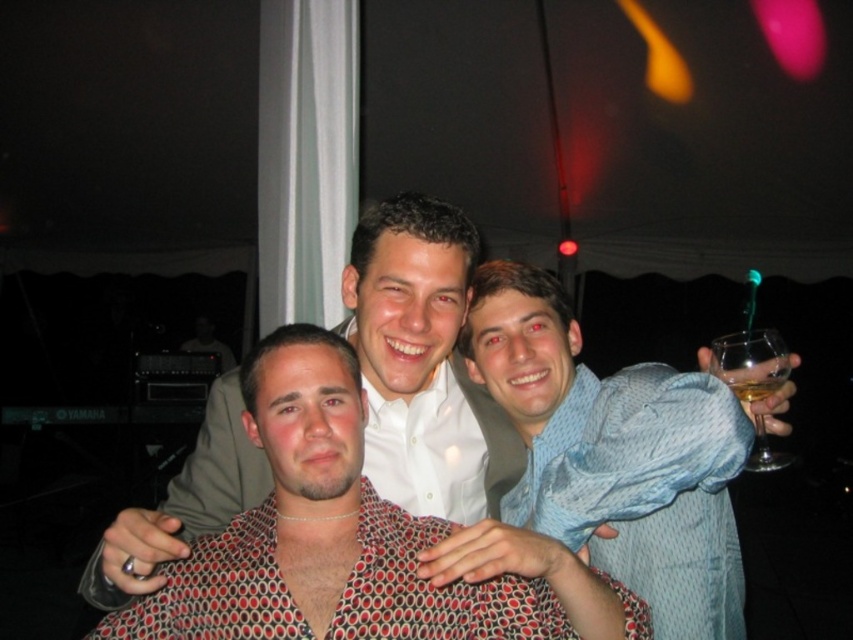
Question: Can you confirm if blue textured shirt at center is positioned to the left of clear glass wine glass at right?

Choices:
 (A) yes
 (B) no

Answer: (A)

Question: Which point appears closest to the camera in this image?

Choices:
 (A) (746, 401)
 (B) (276, 518)
 (C) (548, 394)

Answer: (B)

Question: In this image, where is polka dot shirt at center located relative to clear glass wine glass at right?

Choices:
 (A) below
 (B) above

Answer: (A)

Question: Can you confirm if polka dot shirt at center is positioned below clear glass wine glass at right?

Choices:
 (A) yes
 (B) no

Answer: (A)

Question: Which is farther from the polka dot shirt at center?

Choices:
 (A) clear glass wine glass at right
 (B) blue textured shirt at center

Answer: (A)

Question: Which of the following is the closest to the observer?

Choices:
 (A) blue textured shirt at center
 (B) polka dot shirt at center
 (C) clear glass wine glass at right

Answer: (B)